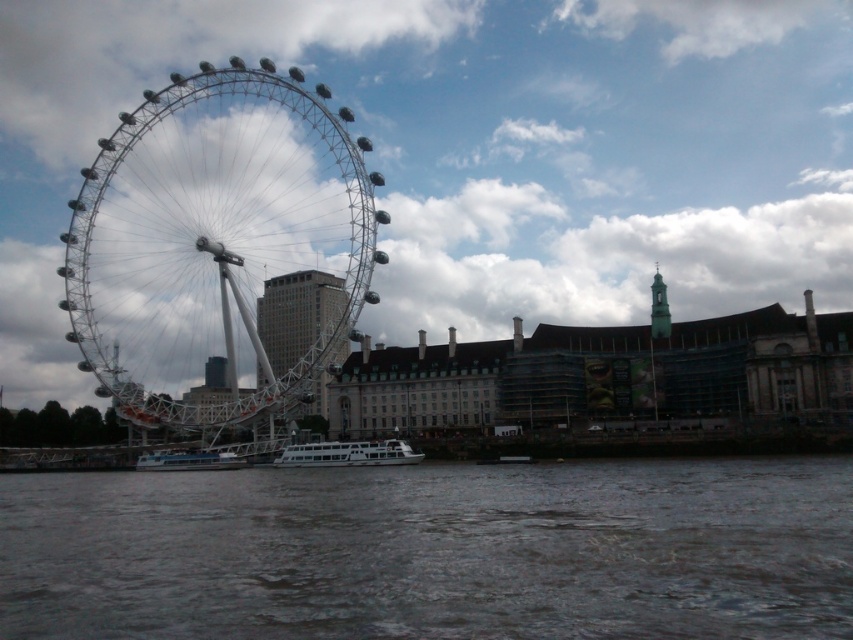
Is dark gray water at lower center smaller than white glossy boat at lower center?

Incorrect, dark gray water at lower center is not smaller in size than white glossy boat at lower center.

Is dark gray water at lower center positioned before white glossy boat at lower center?

That is True.

Measure the distance between dark gray water at lower center and camera.

dark gray water at lower center is 168.14 feet from camera.

Identify the location of dark gray water at lower center. Image resolution: width=853 pixels, height=640 pixels. (433, 552).

Does white metallic ferris wheel at left have a greater height compared to white glossy boat at lower center?

Correct, white metallic ferris wheel at left is much taller as white glossy boat at lower center.

Is white metallic ferris wheel at left bigger than white glossy boat at lower center?

Yes.

Between point (206, 420) and point (146, 467), which one is positioned in front?

Point (206, 420) is in front.

This screenshot has width=853, height=640. Find the location of `white metallic ferris wheel at left`. white metallic ferris wheel at left is located at coordinates (221, 252).

Is point (218, 342) positioned after point (402, 458)?

Yes, it is.

Does white metallic ferris wheel at left appear over white glossy boat at center?

Yes.

Between point (126, 346) and point (276, 461), which one is positioned in front?

Point (276, 461)

Identify the location of white metallic ferris wheel at left. (221, 252).